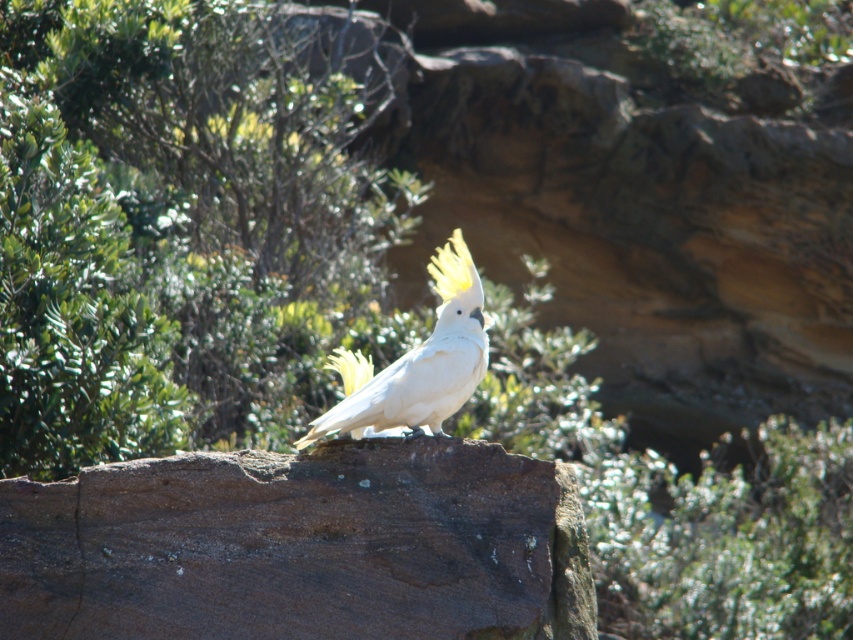
You are standing at point (376, 408) and want to walk to point (219, 93). Which direction should you move relative to the white cockatoo perched on the rugged brownish rock surface?

You should move behind the white cockatoo perched on the rugged brownish rock surface because point (219, 93) is located behind point (376, 408).

You are a birdwatcher observing the scene. You notice the brown rough rock at center and the white feathered cockatoo at center. Which object is shorter in height?

The brown rough rock at center is shorter than the white feathered cockatoo at center according to the description.